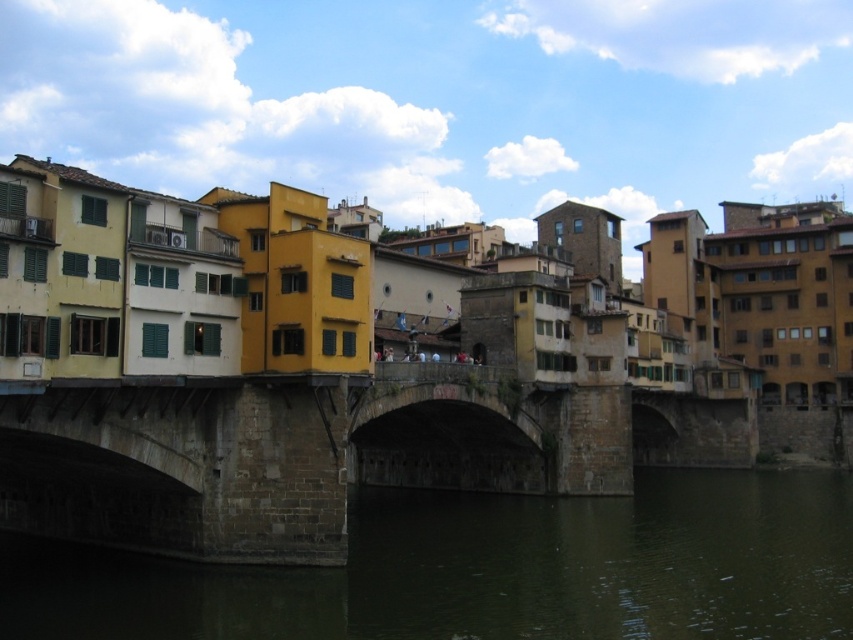
Question: Is dark green water at center positioned at the back of stone bridge at center?

Choices:
 (A) no
 (B) yes

Answer: (A)

Question: Can you confirm if dark green water at center is positioned below stone bridge at center?

Choices:
 (A) yes
 (B) no

Answer: (A)

Question: Which point is closer to the camera?

Choices:
 (A) (212, 620)
 (B) (605, 435)

Answer: (A)

Question: Where is dark green water at center located in relation to stone bridge at center in the image?

Choices:
 (A) above
 (B) below

Answer: (B)